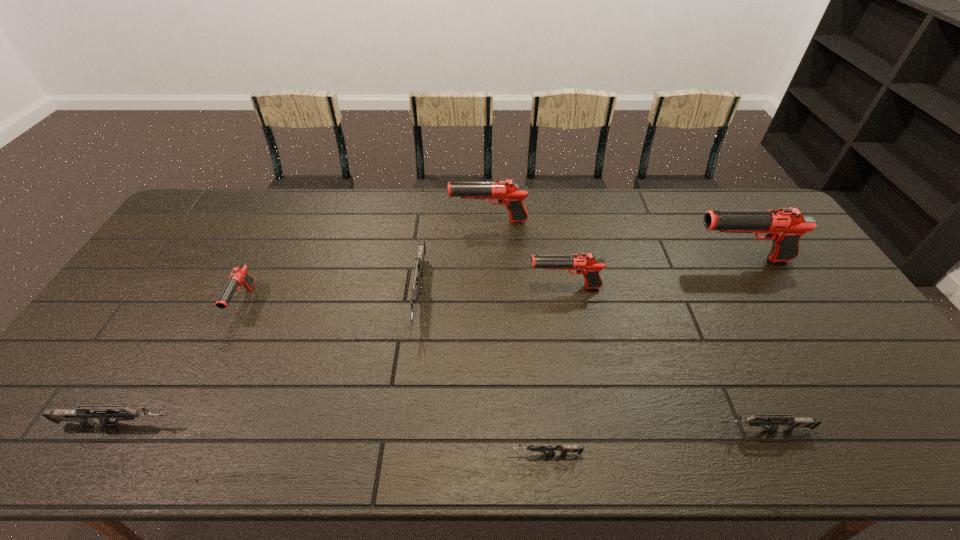
Identify the location of the tallest object. (785, 226).

Identify the location of the tallest gun. (785, 226).

Locate an element on the screen. This screenshot has height=540, width=960. the second tallest gun is located at coordinates (508, 193).

Image resolution: width=960 pixels, height=540 pixels. Identify the location of the third smallest black gun. (508, 193).

You are a GUI agent. You are given a task and a screenshot of the screen. Output one action in this format:
    pyautogui.click(x=<x>, y=<y>)
    Task: Click on the sixth shortest gun
    This screenshot has height=540, width=960.
    Given the screenshot: What is the action you would take?
    pyautogui.click(x=587, y=264)

At what (x,y) coordinates should I click in order to perform the action: click on the third tallest object. Please return your answer as a coordinate pair (x, y). The image size is (960, 540). Looking at the image, I should click on (587, 264).

The width and height of the screenshot is (960, 540). Find the location of `the leftmost black gun`. the leftmost black gun is located at coordinates [x=238, y=277].

Where is `the second grey gun from left to right`? The image size is (960, 540). the second grey gun from left to right is located at coordinates (419, 260).

I want to click on the farthest grey gun, so click(x=419, y=260).

Locate an element on the screen. the second biggest grey gun is located at coordinates (82, 414).